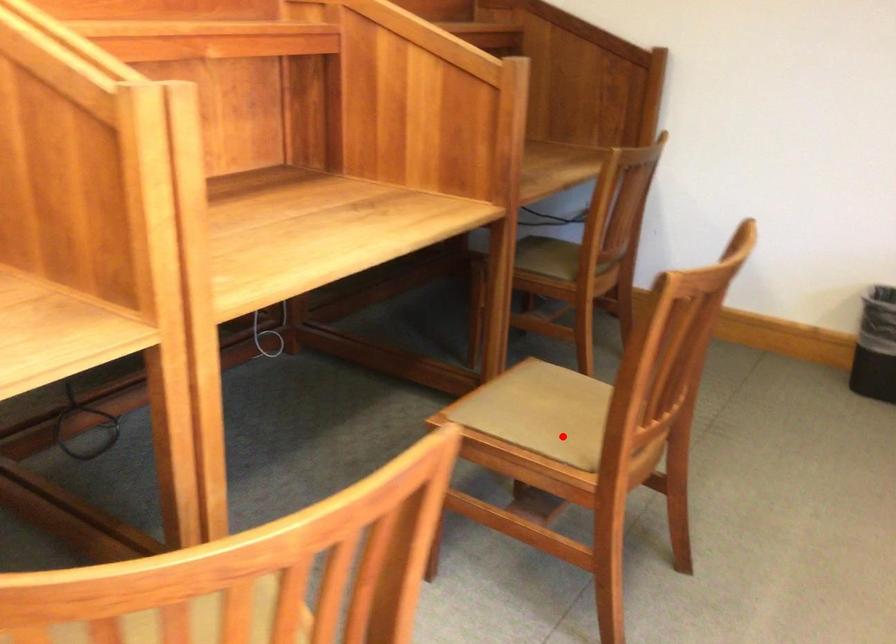
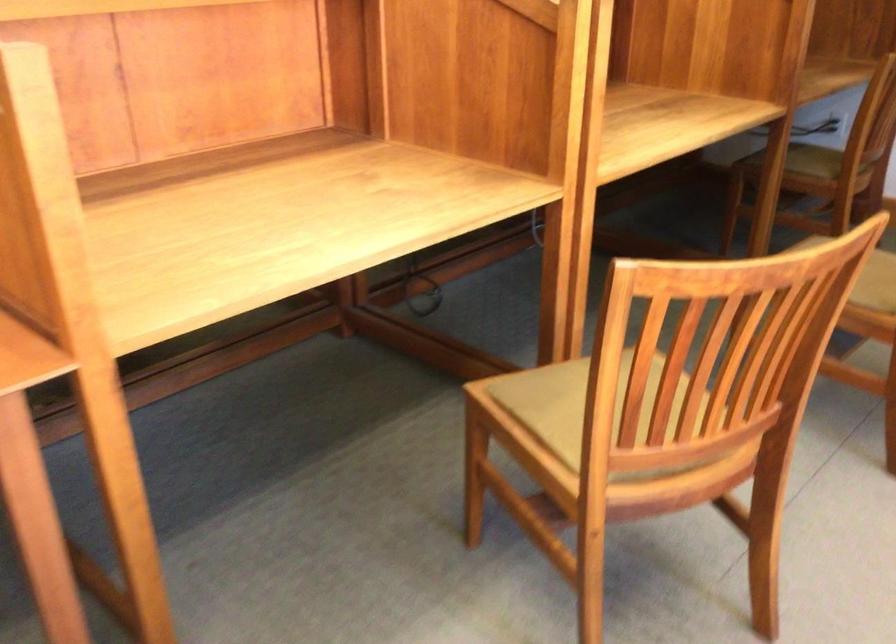
Question: I am providing you with two images of the same scene from different viewpoints. Image1 has a red point marked. In image2, the corresponding 3D location appears at what relative position? Reply with the corresponding letter.

Choices:
 (A) Closer
 (B) Farther

Answer: (B)